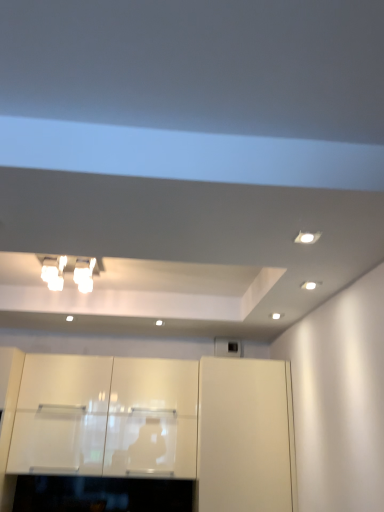
This screenshot has width=384, height=512. What do you see at coordinates (54, 271) in the screenshot?
I see `white glossy light fixture at upper left` at bounding box center [54, 271].

At what (x,y) coordinates should I click in order to perform the action: click on white glossy cabinet at center, positioned as the first cabinetry in right-to-left order. Please return your answer as a coordinate pair (x, y). This screenshot has height=512, width=384. Looking at the image, I should click on (245, 436).

How much distance is there between white glossy light fixture at upper left and white glossy cabinet at center, the 3th cabinetry in the left-to-right sequence?

white glossy light fixture at upper left and white glossy cabinet at center, the 3th cabinetry in the left-to-right sequence, are 4.64 feet apart.

Find the location of a particular element. This screenshot has width=384, height=512. light fixture that appears on the left of white glossy cabinet at center, positioned as the first cabinetry in right-to-left order is located at coordinates (54, 271).

From a real-world perspective, is white glossy light fixture at upper left above or below white glossy cabinet at center, the 3th cabinetry in the left-to-right sequence?

From a real-world perspective, white glossy light fixture at upper left is physically above white glossy cabinet at center, the 3th cabinetry in the left-to-right sequence.

Looking at this image, considering the relative positions of white glossy light fixture at upper left and white glossy cabinet at center, positioned as the first cabinetry in right-to-left order, in the image provided, is white glossy light fixture at upper left to the left of white glossy cabinet at center, positioned as the first cabinetry in right-to-left order, from the viewer's perspective?

Yes.

Is point (75, 270) more distant than point (33, 403)?

That is False.

Is white glossy light fixture at upper left outside of white glossy cabinet at center, which is the 1th cabinetry from left to right?

Indeed, white glossy light fixture at upper left is completely outside white glossy cabinet at center, which is the 1th cabinetry from left to right.

Considering the positions of objects white glossy light fixture at upper left and white glossy cabinet at center, the third cabinetry positioned from the right, in the image provided, who is more to the left, white glossy light fixture at upper left or white glossy cabinet at center, the third cabinetry positioned from the right,?

From the viewer's perspective, white glossy light fixture at upper left appears more on the left side.

How many degrees apart are the facing directions of glossy white cabinets at center, which is counted as the second cabinetry, starting from the right, and white glossy cabinet at center, which is the 1th cabinetry from left to right?

0.381 degrees separate the facing orientations of glossy white cabinets at center, which is counted as the second cabinetry, starting from the right, and white glossy cabinet at center, which is the 1th cabinetry from left to right.

How far apart are glossy white cabinets at center, which is counted as the second cabinetry, starting from the right, and white glossy cabinet at center, the third cabinetry positioned from the right?

A distance of 8.62 inches exists between glossy white cabinets at center, which is counted as the second cabinetry, starting from the right, and white glossy cabinet at center, the third cabinetry positioned from the right.

Considering the sizes of objects glossy white cabinets at center, which is the second cabinetry from left to right, and white glossy cabinet at center, the third cabinetry positioned from the right, in the image provided, who is wider, glossy white cabinets at center, which is the second cabinetry from left to right, or white glossy cabinet at center, the third cabinetry positioned from the right,?

white glossy cabinet at center, the third cabinetry positioned from the right, is wider.

Where is `the 1st cabinetry to the right of the white glossy cabinet at center, which is the 1th cabinetry from left to right, starting your count from the anchor`? the 1st cabinetry to the right of the white glossy cabinet at center, which is the 1th cabinetry from left to right, starting your count from the anchor is located at coordinates (153, 425).

Is white glossy cabinet at center, the 3th cabinetry in the left-to-right sequence, inside or outside of glossy white cabinets at center, which is the second cabinetry from left to right?

white glossy cabinet at center, the 3th cabinetry in the left-to-right sequence, is spatially situated outside glossy white cabinets at center, which is the second cabinetry from left to right.

From the image's perspective, would you say white glossy cabinet at center, positioned as the first cabinetry in right-to-left order, is shown under glossy white cabinets at center, which is counted as the second cabinetry, starting from the right?

Correct, white glossy cabinet at center, positioned as the first cabinetry in right-to-left order, appears lower than glossy white cabinets at center, which is counted as the second cabinetry, starting from the right, in the image.

Is white glossy cabinet at center, positioned as the first cabinetry in right-to-left order, facing away from glossy white cabinets at center, which is counted as the second cabinetry, starting from the right?

white glossy cabinet at center, positioned as the first cabinetry in right-to-left order, does not have its back to glossy white cabinets at center, which is counted as the second cabinetry, starting from the right.

Is white glossy cabinet at center, positioned as the first cabinetry in right-to-left order, in front of or behind white glossy cabinet at center, the third cabinetry positioned from the right, in the image?

white glossy cabinet at center, positioned as the first cabinetry in right-to-left order, is positioned closer to the viewer than white glossy cabinet at center, the third cabinetry positioned from the right.

From the image's perspective, is white glossy cabinet at center, positioned as the first cabinetry in right-to-left order, above white glossy cabinet at center, the third cabinetry positioned from the right?

Actually, white glossy cabinet at center, positioned as the first cabinetry in right-to-left order, appears below white glossy cabinet at center, the third cabinetry positioned from the right, in the image.

Considering the relative sizes of white glossy cabinet at center, positioned as the first cabinetry in right-to-left order, and white glossy cabinet at center, the third cabinetry positioned from the right, in the image provided, is white glossy cabinet at center, positioned as the first cabinetry in right-to-left order, wider than white glossy cabinet at center, the third cabinetry positioned from the right,?

Indeed, white glossy cabinet at center, positioned as the first cabinetry in right-to-left order, has a greater width compared to white glossy cabinet at center, the third cabinetry positioned from the right.

Which of these two, white glossy cabinet at center, positioned as the first cabinetry in right-to-left order, or white glossy cabinet at center, which is the 1th cabinetry from left to right, is bigger?

With larger size is white glossy cabinet at center, positioned as the first cabinetry in right-to-left order.

Between point (52, 437) and point (233, 486), which one is positioned behind?

The point (52, 437) is farther from the camera.

From the image's perspective, is white glossy cabinet at center, which is the 1th cabinetry from left to right, located beneath glossy white cabinets at center, which is the second cabinetry from left to right?

Yes, from the image's perspective, white glossy cabinet at center, which is the 1th cabinetry from left to right, is below glossy white cabinets at center, which is the second cabinetry from left to right.

This screenshot has width=384, height=512. I want to click on cabinetry above the white glossy cabinet at center, which is the 1th cabinetry from left to right (from the image's perspective), so click(x=153, y=425).

Is point (30, 426) closer to viewer compared to point (92, 259)?

No, (30, 426) is further to viewer.

Is white glossy light fixture at upper left at the back of white glossy cabinet at center, which is the 1th cabinetry from left to right?

white glossy cabinet at center, which is the 1th cabinetry from left to right, does not have its back to white glossy light fixture at upper left.

Between white glossy cabinet at center, the third cabinetry positioned from the right, and white glossy light fixture at upper left, which one appears on the left side from the viewer's perspective?

Positioned to the left is white glossy light fixture at upper left.

Is white glossy cabinet at center, the third cabinetry positioned from the right, shorter than white glossy light fixture at upper left?

No.

Where is `light fixture in front of the white glossy cabinet at center, the 3th cabinetry in the left-to-right sequence`? This screenshot has width=384, height=512. light fixture in front of the white glossy cabinet at center, the 3th cabinetry in the left-to-right sequence is located at coordinates (54, 271).

Where is `light fixture above the white glossy cabinet at center, which is the 1th cabinetry from left to right (from the image's perspective)`? This screenshot has height=512, width=384. light fixture above the white glossy cabinet at center, which is the 1th cabinetry from left to right (from the image's perspective) is located at coordinates (54, 271).

Which object lies nearer to the anchor point white glossy cabinet at center, the third cabinetry positioned from the right, glossy white cabinets at center, which is the second cabinetry from left to right, or white glossy light fixture at upper left?

glossy white cabinets at center, which is the second cabinetry from left to right, lies closer to white glossy cabinet at center, the third cabinetry positioned from the right, than the other object.

Which object lies further to the anchor point white glossy cabinet at center, the 3th cabinetry in the left-to-right sequence, white glossy cabinet at center, the third cabinetry positioned from the right, or white glossy light fixture at upper left?

white glossy light fixture at upper left is positioned further to the anchor white glossy cabinet at center, the 3th cabinetry in the left-to-right sequence.

Based on their spatial positions, is white glossy cabinet at center, which is the 1th cabinetry from left to right, or white glossy cabinet at center, positioned as the first cabinetry in right-to-left order, further from glossy white cabinets at center, which is the second cabinetry from left to right?

white glossy cabinet at center, positioned as the first cabinetry in right-to-left order.

Estimate the real-world distances between objects in this image. Which object is closer to white glossy cabinet at center, positioned as the first cabinetry in right-to-left order, glossy white cabinets at center, which is the second cabinetry from left to right, or white glossy cabinet at center, which is the 1th cabinetry from left to right?

The object closer to white glossy cabinet at center, positioned as the first cabinetry in right-to-left order, is glossy white cabinets at center, which is the second cabinetry from left to right.

When comparing their distances from white glossy cabinet at center, which is the 1th cabinetry from left to right, does white glossy cabinet at center, positioned as the first cabinetry in right-to-left order, or white glossy light fixture at upper left seem further?

Among the two, white glossy cabinet at center, positioned as the first cabinetry in right-to-left order, is located further to white glossy cabinet at center, which is the 1th cabinetry from left to right.

Consider the image. Based on their spatial positions, is white glossy light fixture at upper left or white glossy cabinet at center, the third cabinetry positioned from the right, further from glossy white cabinets at center, which is the second cabinetry from left to right?

The object further to glossy white cabinets at center, which is the second cabinetry from left to right, is white glossy light fixture at upper left.

In the scene shown: Considering their positions, is glossy white cabinets at center, which is counted as the second cabinetry, starting from the right, positioned closer to white glossy cabinet at center, the third cabinetry positioned from the right, than white glossy cabinet at center, positioned as the first cabinetry in right-to-left order?

The object closer to white glossy cabinet at center, the third cabinetry positioned from the right, is glossy white cabinets at center, which is counted as the second cabinetry, starting from the right.

From the picture: Considering their positions, is white glossy cabinet at center, which is the 1th cabinetry from left to right, positioned further to white glossy light fixture at upper left than glossy white cabinets at center, which is counted as the second cabinetry, starting from the right?

glossy white cabinets at center, which is counted as the second cabinetry, starting from the right, is further to white glossy light fixture at upper left.

Locate an element on the screen. The height and width of the screenshot is (512, 384). cabinetry between white glossy light fixture at upper left and white glossy cabinet at center, which is the 1th cabinetry from left to right, in the up-down direction is located at coordinates (153, 425).

Image resolution: width=384 pixels, height=512 pixels. Identify the location of cabinetry between white glossy cabinet at center, the third cabinetry positioned from the right, and white glossy cabinet at center, the 3th cabinetry in the left-to-right sequence, from left to right. coord(153,425).